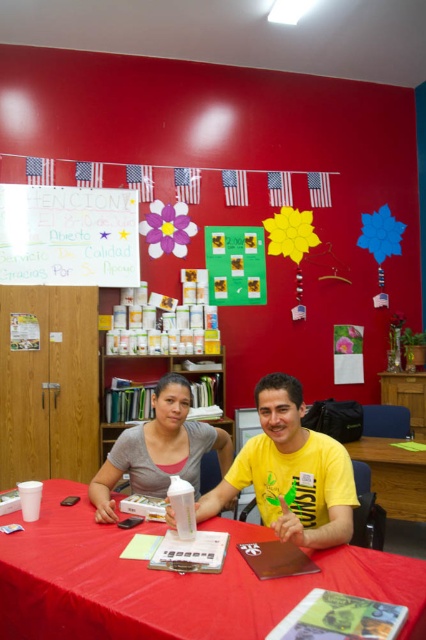
You are organizing a community event and need to ensure that all items on the table are visible to participants. Given the yellow matte shirt at center and the matte white lotion at center, which item takes up more space and might block the view of other items?

The matte white lotion at center occupies more space than the yellow matte shirt at center, so it might block the view of other items.

You are standing in the community center and see the yellow matte shirt at center and the colored paper sign at upper left. Which object is positioned to the right of the other?

The yellow matte shirt at center is to the right of colored paper sign at upper left.

You are standing at the entrance of the community center and want to ask someone at the table for information. Which object should you approach first, the smooth plastic table at center or the colored paper sign at upper left?

You should approach the smooth plastic table at center first because it is to the right of the colored paper sign at upper left, meaning it is closer to your position at the entrance.